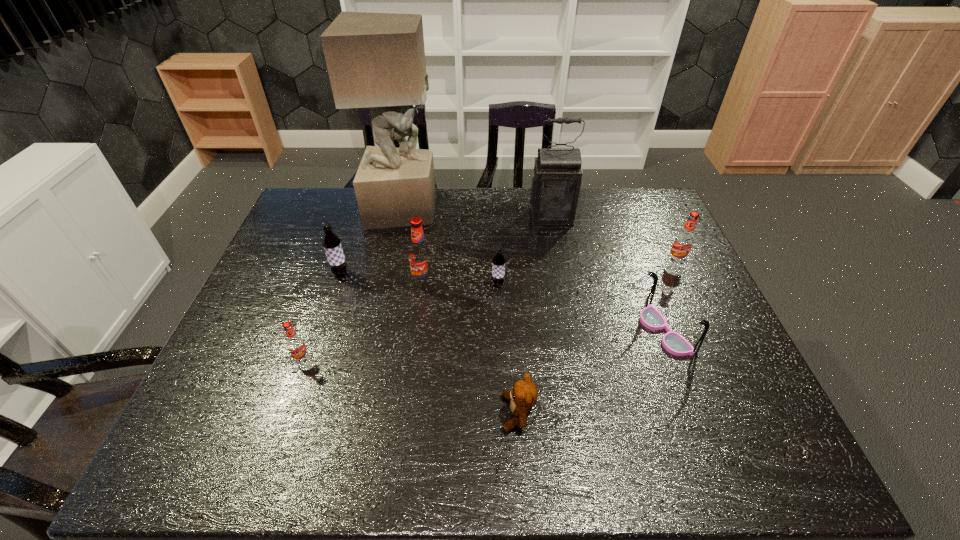
Find the location of a particular element. Image resolution: width=960 pixels, height=540 pixels. vacant space located on the front of the rightmost root beer is located at coordinates (688, 289).

The image size is (960, 540). What are the coordinates of `free space located 0.170m on the right of the bigger brown root beer` in the screenshot? It's located at coord(407,273).

At what (x,y) coordinates should I click in order to perform the action: click on vacant space situated on the front of the pink spectacles. Please return your answer as a coordinate pair (x, y). Looking at the image, I should click on (699, 421).

In order to click on free space located on the back of the nearest root beer in this screenshot , I will do `click(333, 273)`.

In order to click on blank space located 0.140m on the back of the fourth root beer from left to right in this screenshot , I will do `click(496, 248)`.

This screenshot has height=540, width=960. I want to click on blank area located on the front-facing side of the teddy bear, so click(325, 413).

This screenshot has width=960, height=540. I want to click on blank area located 0.110m on the front-facing side of the teddy bear, so click(451, 413).

This screenshot has width=960, height=540. What are the coordinates of `vacant space located on the front-facing side of the teddy bear` in the screenshot? It's located at (397, 413).

Find the location of a particular element. The image size is (960, 540). sculpture located at the far edge is located at coordinates (374, 60).

Find the location of `lantern that is at the far edge`. lantern that is at the far edge is located at coordinates (556, 182).